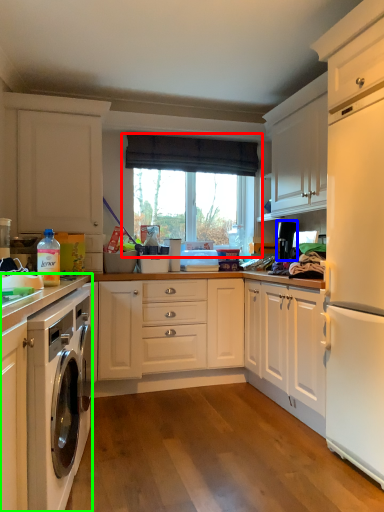
Question: Which is nearer to the window (highlighted by a red box)? appliance (highlighted by a blue box) or cabinetry (highlighted by a green box).

Choices:
 (A) appliance
 (B) cabinetry

Answer: (A)